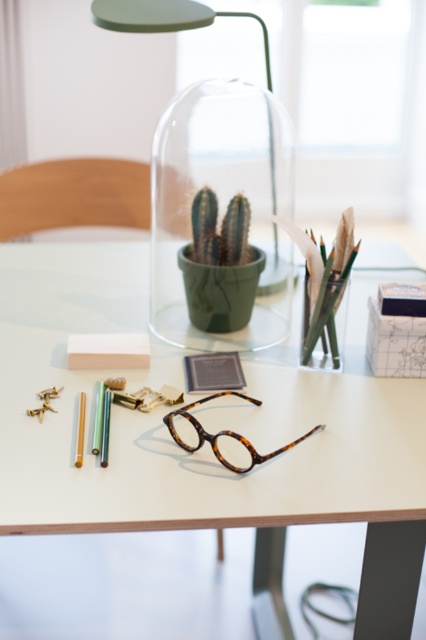
Question: Among these points, which one is farthest from the camera?

Choices:
 (A) (81, 440)
 (B) (218, 438)
 (C) (288, 156)

Answer: (C)

Question: Does tortoiseshell eyeglasses at center have a lesser width compared to pastel green matte crayon at lower left?

Choices:
 (A) no
 (B) yes

Answer: (A)

Question: In this image, where is tortoiseshell glasses at center located relative to pastel green matte crayon at lower left?

Choices:
 (A) left
 (B) right

Answer: (B)

Question: Can you confirm if green matte lampshade at center is positioned to the right of pastel green matte crayon at lower left?

Choices:
 (A) yes
 (B) no

Answer: (A)

Question: Which of these objects is positioned closest to the tortoiseshell eyeglasses at center?

Choices:
 (A) pastel green matte crayon at lower left
 (B) green matte lampshade at center
 (C) tortoiseshell glasses at center

Answer: (C)

Question: Among these points, which one is nearest to the camera?

Choices:
 (A) (397, 394)
 (B) (319, 426)
 (C) (229, 339)
 (D) (75, 442)

Answer: (D)